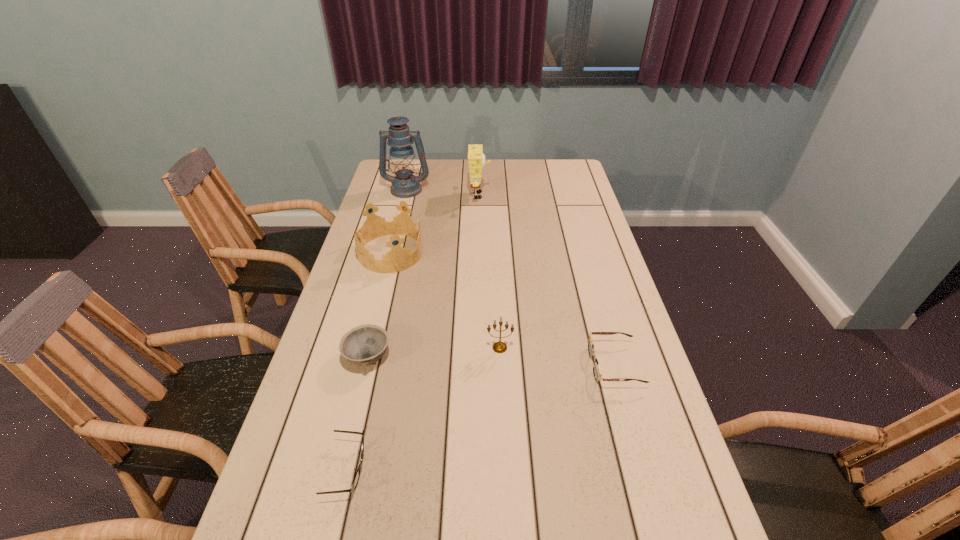
At what (x,y) coordinates should I click in order to perform the action: click on free space between the sponge and the bowl. Please return your answer as a coordinate pair (x, y). Image resolution: width=960 pixels, height=540 pixels. Looking at the image, I should click on (423, 276).

Where is `free space between the right spectacles and the candelabrum`? Image resolution: width=960 pixels, height=540 pixels. free space between the right spectacles and the candelabrum is located at coordinates (557, 356).

At what (x,y) coordinates should I click in order to perform the action: click on free space between the sponge and the third shortest object. Please return your answer as a coordinate pair (x, y). The width and height of the screenshot is (960, 540). Looking at the image, I should click on (423, 276).

Identify the location of vacant space in between the right spectacles and the sponge. (547, 280).

Identify the location of free space between the left spectacles and the sixth shortest object. The width and height of the screenshot is (960, 540). (414, 333).

The height and width of the screenshot is (540, 960). Identify the location of free space that is in between the third shortest object and the tallest object. (387, 273).

Locate an element on the screen. The image size is (960, 540). free spot between the fifth nearest object and the bowl is located at coordinates (379, 305).

Where is `vacant space that's between the right spectacles and the fourth tallest object`? The image size is (960, 540). vacant space that's between the right spectacles and the fourth tallest object is located at coordinates (557, 356).

Locate an element on the screen. Image resolution: width=960 pixels, height=540 pixels. vacant space that's between the fourth shortest object and the fifth nearest object is located at coordinates (444, 300).

Point out which object is positioned as the fourth nearest to the nearest object. Please provide its 2D coordinates. Your answer should be formatted as a tuple, i.e. [(x, y)], where the tuple contains the x and y coordinates of a point satisfying the conditions above.

[(398, 258)]